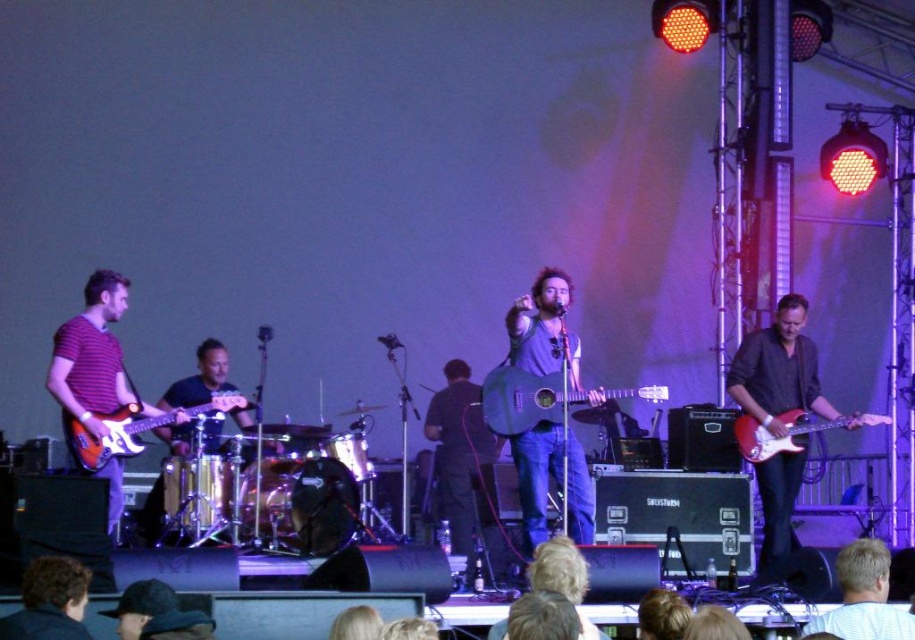
Is striped fabric guitar at left positioned behind dark blue jeans at center?

No, striped fabric guitar at left is in front of dark blue jeans at center.

Is point (104, 356) less distant than point (499, 444)?

That is True.

Find the location of a particular element. striped fabric guitar at left is located at coordinates (92, 355).

Is point (787, 337) positioned after point (52, 624)?

Yes.

I want to click on matte red electric guitar at right, so click(x=780, y=371).

Which is in front, point (774, 368) or point (20, 632)?

Positioned in front is point (20, 632).

The image size is (915, 640). I want to click on matte red electric guitar at right, so [x=780, y=371].

Does matte electric guitar at left have a lesser height compared to glossy red electric guitar at right?

In fact, matte electric guitar at left may be taller than glossy red electric guitar at right.

Is matte electric guitar at left above glossy red electric guitar at right?

Yes.

Between point (199, 406) and point (802, 417), which one is positioned behind?

Positioned behind is point (802, 417).

Locate an element on the screen. Image resolution: width=915 pixels, height=640 pixels. matte electric guitar at left is located at coordinates (135, 428).